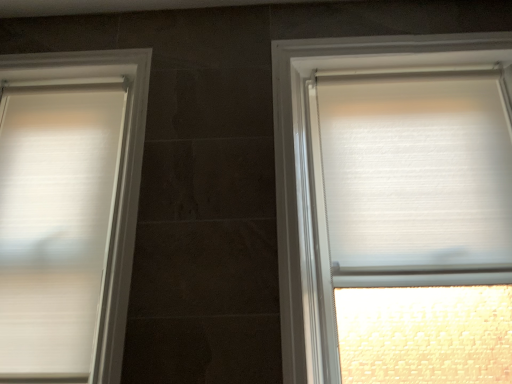
Image resolution: width=512 pixels, height=384 pixels. I want to click on white textured blind at right, so click(417, 173).

What do you see at coordinates (68, 211) in the screenshot? The image size is (512, 384). I see `white matte blinds at left, acting as the 1th window starting from the left` at bounding box center [68, 211].

Where is `white textured blind at right`? white textured blind at right is located at coordinates (417, 173).

Is white matte blinds at left, arranged as the 2th window when viewed from the right, shorter than white textured roller blind at right, which is the 1th window in right-to-left order?

Indeed, white matte blinds at left, arranged as the 2th window when viewed from the right, has a lesser height compared to white textured roller blind at right, which is the 1th window in right-to-left order.

Is the depth of white matte blinds at left, arranged as the 2th window when viewed from the right, less than that of white textured roller blind at right, which is counted as the 2th window, starting from the left?

No, white matte blinds at left, arranged as the 2th window when viewed from the right, is behind white textured roller blind at right, which is counted as the 2th window, starting from the left.

How distant is white matte blinds at left, acting as the 1th window starting from the left, from white textured roller blind at right, which is counted as the 2th window, starting from the left?

75.16 centimeters.

Who is smaller, white matte blinds at left, acting as the 1th window starting from the left, or white textured roller blind at right, which is counted as the 2th window, starting from the left?

white matte blinds at left, acting as the 1th window starting from the left, is smaller.

From the image's perspective, which is above, white textured blind at right or white matte blinds at left, acting as the 1th window starting from the left?

white textured blind at right.

In the scene shown: Considering the relative sizes of white textured blind at right and white matte blinds at left, acting as the 1th window starting from the left, in the image provided, is white textured blind at right smaller than white matte blinds at left, acting as the 1th window starting from the left,?

Indeed, white textured blind at right has a smaller size compared to white matte blinds at left, acting as the 1th window starting from the left.

Is white textured blind at right aimed at white matte blinds at left, arranged as the 2th window when viewed from the right?

No, white textured blind at right is not oriented towards white matte blinds at left, arranged as the 2th window when viewed from the right.

Measure the distance from white textured blind at right to white matte blinds at left, acting as the 1th window starting from the left.

The distance of white textured blind at right from white matte blinds at left, acting as the 1th window starting from the left, is 38.20 inches.

Considering the relative sizes of white textured roller blind at right, which is counted as the 2th window, starting from the left, and white matte blinds at left, arranged as the 2th window when viewed from the right, in the image provided, is white textured roller blind at right, which is counted as the 2th window, starting from the left, taller than white matte blinds at left, arranged as the 2th window when viewed from the right,?

Yes.

From a real-world perspective, between white textured roller blind at right, which is counted as the 2th window, starting from the left, and white matte blinds at left, arranged as the 2th window when viewed from the right, who is vertically higher?

From a 3D spatial view, white matte blinds at left, arranged as the 2th window when viewed from the right, is above.

Which of these two, white textured roller blind at right, which is counted as the 2th window, starting from the left, or white textured blind at right, stands taller?

With more height is white textured roller blind at right, which is counted as the 2th window, starting from the left.

Does white textured roller blind at right, which is the 1th window in right-to-left order, have a smaller size compared to white textured blind at right?

No.

From a real-world perspective, is white textured roller blind at right, which is counted as the 2th window, starting from the left, over white textured blind at right?

No, from a real-world perspective, white textured roller blind at right, which is counted as the 2th window, starting from the left, is not above white textured blind at right.

Which of these two, white textured roller blind at right, which is counted as the 2th window, starting from the left, or white textured blind at right, is wider?

Wider between the two is white textured roller blind at right, which is counted as the 2th window, starting from the left.

Is white matte blinds at left, acting as the 1th window starting from the left, facing towards white textured blind at right?

No, white matte blinds at left, acting as the 1th window starting from the left, is not facing towards white textured blind at right.

From the image's perspective, which object appears higher, white matte blinds at left, arranged as the 2th window when viewed from the right, or white textured blind at right?

white textured blind at right appears higher in the image.

Does white matte blinds at left, arranged as the 2th window when viewed from the right, have a larger size compared to white textured blind at right?

Indeed, white matte blinds at left, arranged as the 2th window when viewed from the right, has a larger size compared to white textured blind at right.

Is white textured blind at right inside white matte blinds at left, arranged as the 2th window when viewed from the right?

Actually, white textured blind at right is outside white matte blinds at left, arranged as the 2th window when viewed from the right.

From the image's perspective, which is above, white textured blind at right or white textured roller blind at right, which is the 1th window in right-to-left order?

white textured blind at right appears higher in the image.

From a real-world perspective, who is located lower, white textured blind at right or white textured roller blind at right, which is counted as the 2th window, starting from the left?

From a 3D spatial view, white textured roller blind at right, which is counted as the 2th window, starting from the left, is below.

Looking at this image, would you say white textured blind at right contains white textured roller blind at right, which is counted as the 2th window, starting from the left?

Yes, white textured roller blind at right, which is counted as the 2th window, starting from the left, is a part of white textured blind at right.

Is there a large distance between white textured blind at right and white textured roller blind at right, which is the 1th window in right-to-left order?

white textured blind at right is near white textured roller blind at right, which is the 1th window in right-to-left order, not far away.

I want to click on window lying below the white textured roller blind at right, which is the 1th window in right-to-left order (from the image's perspective), so click(68, 211).

I want to click on the 2nd window to the left of the white textured blind at right, starting your count from the anchor, so click(x=68, y=211).

Estimate the real-world distances between objects in this image. Which object is further from white matte blinds at left, arranged as the 2th window when viewed from the right, white textured roller blind at right, which is the 1th window in right-to-left order, or white textured blind at right?

white textured blind at right is positioned further to the anchor white matte blinds at left, arranged as the 2th window when viewed from the right.

From the image, which object appears to be nearer to white textured roller blind at right, which is counted as the 2th window, starting from the left, white textured blind at right or white matte blinds at left, acting as the 1th window starting from the left?

white textured blind at right is positioned closer to the anchor white textured roller blind at right, which is counted as the 2th window, starting from the left.

Considering their positions, is white matte blinds at left, acting as the 1th window starting from the left, positioned further to white textured roller blind at right, which is counted as the 2th window, starting from the left, than white textured blind at right?

Among the two, white matte blinds at left, acting as the 1th window starting from the left, is located further to white textured roller blind at right, which is counted as the 2th window, starting from the left.

Considering their positions, is white textured roller blind at right, which is the 1th window in right-to-left order, positioned closer to white textured blind at right than white matte blinds at left, arranged as the 2th window when viewed from the right?

Among the two, white textured roller blind at right, which is the 1th window in right-to-left order, is located nearer to white textured blind at right.

From the image, which object appears to be farther from white matte blinds at left, acting as the 1th window starting from the left, white textured blind at right or white textured roller blind at right, which is the 1th window in right-to-left order?

The object further to white matte blinds at left, acting as the 1th window starting from the left, is white textured blind at right.

Consider the image. Based on their spatial positions, is white matte blinds at left, acting as the 1th window starting from the left, or white textured roller blind at right, which is the 1th window in right-to-left order, further from white textured blind at right?

white matte blinds at left, acting as the 1th window starting from the left.

Identify the location of window situated between white matte blinds at left, arranged as the 2th window when viewed from the right, and white textured blind at right from left to right. (321, 185).